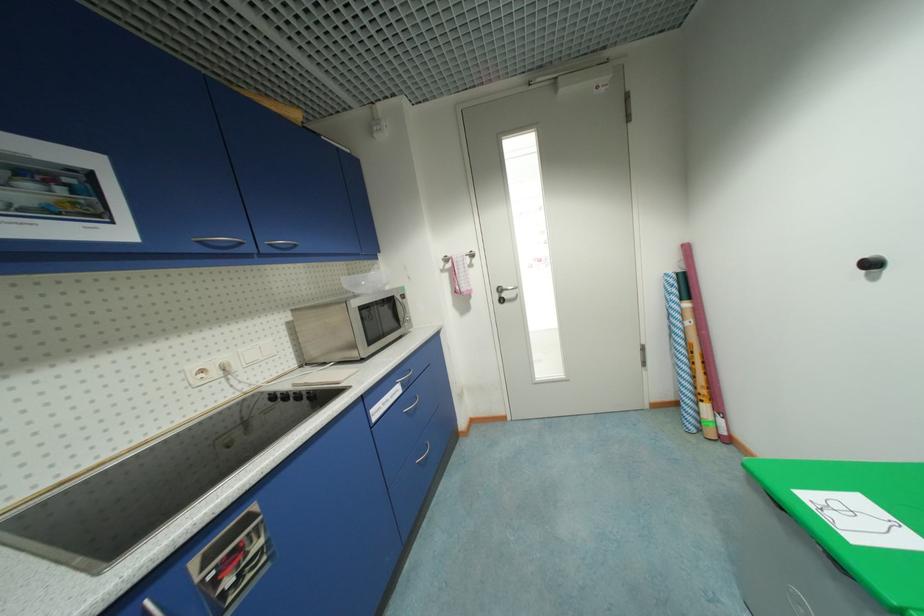
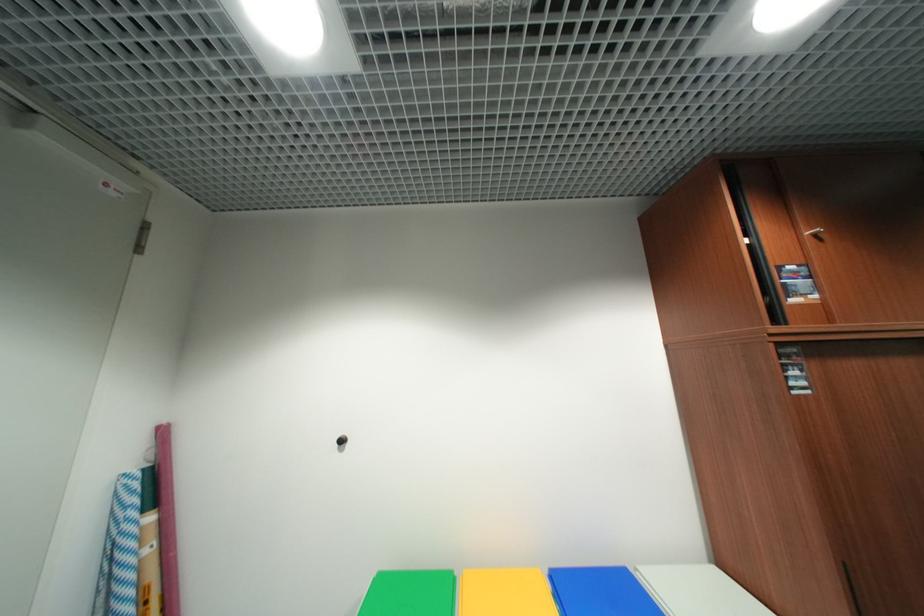
How did the camera likely rotate?

The rotation direction of the camera is right-up.